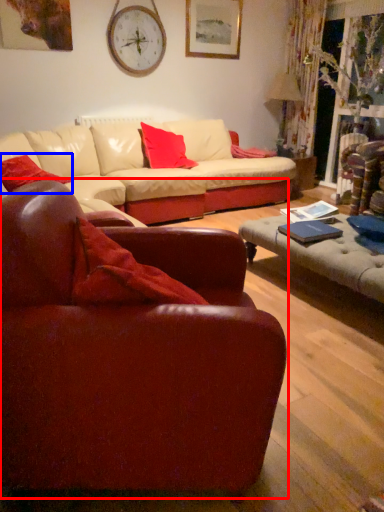
Question: Among these objects, which one is farthest to the camera, studio couch (highlighted by a red box) or pillow (highlighted by a blue box)?

Choices:
 (A) studio couch
 (B) pillow

Answer: (B)